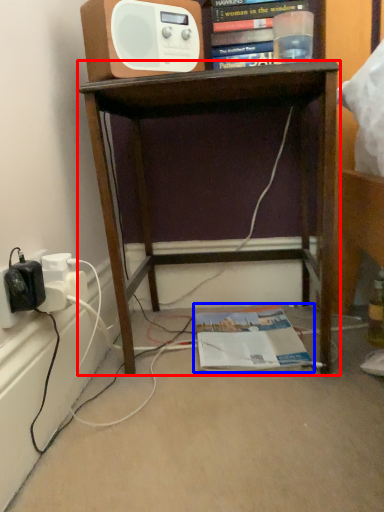
Question: Which of the following is the farthest to the observer, desk (highlighted by a red box) or magazine (highlighted by a blue box)?

Choices:
 (A) desk
 (B) magazine

Answer: (B)